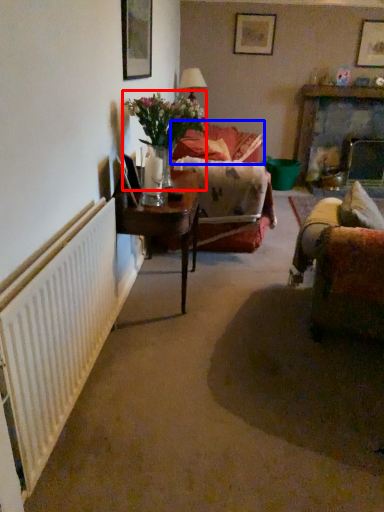
Question: Which object appears closest to the camera in this image, floral arrangement (highlighted by a red box) or couch (highlighted by a blue box)?

Choices:
 (A) floral arrangement
 (B) couch

Answer: (A)